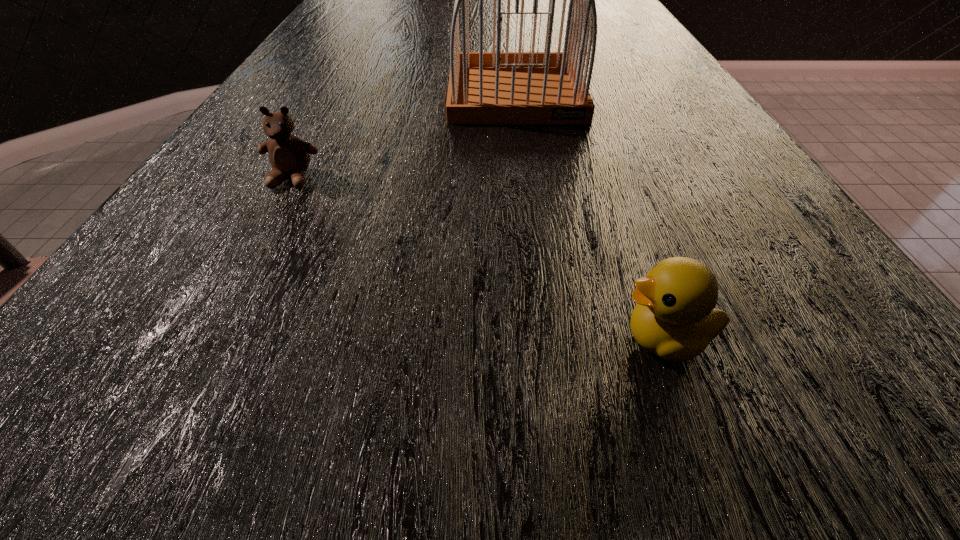
You are a GUI agent. You are given a task and a screenshot of the screen. Output one action in this format:
    pyautogui.click(x=<x>, y=<y>)
    Task: Click on the tallest object
    Image resolution: width=960 pixels, height=540 pixels.
    Given the screenshot: What is the action you would take?
    pyautogui.click(x=498, y=87)

Where is `the farthest object`? This screenshot has height=540, width=960. the farthest object is located at coordinates (498, 87).

Image resolution: width=960 pixels, height=540 pixels. I want to click on teddy bear, so click(289, 155).

In order to click on the leftmost object in this screenshot , I will do `click(289, 155)`.

The width and height of the screenshot is (960, 540). In order to click on duck in this screenshot , I will do `click(674, 318)`.

The height and width of the screenshot is (540, 960). I want to click on vacant space located with an open door on the farthest object, so click(x=529, y=197).

Where is `free location located 0.060m on the front-facing side of the second nearest object`? This screenshot has height=540, width=960. free location located 0.060m on the front-facing side of the second nearest object is located at coordinates (272, 218).

The image size is (960, 540). Find the location of `vacant space located on the face of the nearest object`. vacant space located on the face of the nearest object is located at coordinates (264, 339).

Where is `vacant area located 0.160m on the face of the nearest object`? vacant area located 0.160m on the face of the nearest object is located at coordinates (464, 339).

Locate an element on the screen. Image resolution: width=960 pixels, height=540 pixels. vacant region located 0.110m on the face of the nearest object is located at coordinates (511, 339).